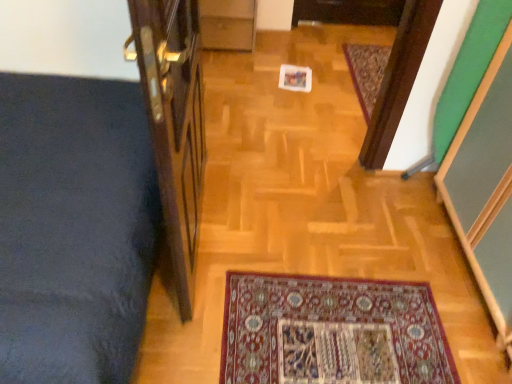
Find the location of `wooden door at left`. wooden door at left is located at coordinates (173, 123).

The width and height of the screenshot is (512, 384). What do you see at coordinates (173, 123) in the screenshot?
I see `wooden door at left` at bounding box center [173, 123].

What is the approximate width of wooden door at left?

wooden door at left is 5.09 inches in width.

Measure the distance between wooden door at left and camera.

The depth of wooden door at left is 75.79 centimeters.

At what (x,y) coordinates should I click in order to perform the action: click on carpeted mat at center. Please return your answer as a coordinate pair (x, y). Image resolution: width=512 pixels, height=384 pixels. Looking at the image, I should click on (367, 72).

What do you see at coordinates (367, 72) in the screenshot?
I see `carpeted mat at center` at bounding box center [367, 72].

Where is `wooden door at left`? The image size is (512, 384). wooden door at left is located at coordinates (173, 123).

Which is more to the left, wooden door at left or carpeted mat at center?

wooden door at left is more to the left.

From the picture: Who is more distant, wooden door at left or carpeted mat at center?

Positioned behind is carpeted mat at center.

Is point (147, 74) positioned behind point (377, 62)?

No.

Based on the photo, from the image's perspective, who appears lower, wooden door at left or carpeted mat at center?

wooden door at left appears lower in the image.

From a real-world perspective, is wooden door at left positioned under carpeted mat at center based on gravity?

No, from a real-world perspective, wooden door at left is not under carpeted mat at center.

Is wooden door at left wider or thinner than carpeted mat at center?

wooden door at left is thinner than carpeted mat at center.

Who is shorter, wooden door at left or carpeted mat at center?

With less height is carpeted mat at center.

From the picture: Does wooden door at left have a smaller size compared to carpeted mat at center?

No, wooden door at left is not smaller than carpeted mat at center.

Is wooden door at left not inside carpeted mat at center?

Yes, wooden door at left is outside of carpeted mat at center.

Are wooden door at left and carpeted mat at center beside each other?

They are not placed beside each other.

Is wooden door at left turned away from carpeted mat at center?

wooden door at left does not have its back to carpeted mat at center.

Identify the location of mat located on the right of wooden door at left. pos(367,72).

Which is more to the right, carpeted mat at center or wooden door at left?

From the viewer's perspective, carpeted mat at center appears more on the right side.

Which is behind, carpeted mat at center or wooden door at left?

carpeted mat at center is further away from the camera.

Does point (371, 104) appear closer or farther from the camera than point (175, 148)?

Point (371, 104) is farther from the camera than point (175, 148).

From the image's perspective, is carpeted mat at center located above wooden door at left?

Yes, from the image's perspective, carpeted mat at center is over wooden door at left.

From a real-world perspective, is carpeted mat at center physically above wooden door at left?

No.

Looking at this image, considering the sizes of objects carpeted mat at center and wooden door at left in the image provided, who is wider, carpeted mat at center or wooden door at left?

With larger width is carpeted mat at center.

Can you confirm if carpeted mat at center is shorter than wooden door at left?

Yes.

Looking at the image, does carpeted mat at center seem bigger or smaller compared to wooden door at left?

Clearly, carpeted mat at center is smaller in size than wooden door at left.

Would you say carpeted mat at center contains wooden door at left?

That's incorrect, wooden door at left is not inside carpeted mat at center.

Is carpeted mat at center directly adjacent to wooden door at left?

No, carpeted mat at center is not touching wooden door at left.

Is carpeted mat at center facing towards wooden door at left?

No, carpeted mat at center is not aimed at wooden door at left.

How different are the orientations of carpeted mat at center and wooden door at left in degrees?

The angular difference between carpeted mat at center and wooden door at left is 177 degrees.

Measure the distance between carpeted mat at center and wooden door at left.

A distance of 1.50 meters exists between carpeted mat at center and wooden door at left.

In the image, there is a wooden door at left. Where is `mat above it (from the image's perspective)`? The width and height of the screenshot is (512, 384). mat above it (from the image's perspective) is located at coordinates (367, 72).

At what (x,y) coordinates should I click in order to perform the action: click on door above the carpeted mat at center (from a real-world perspective). Please return your answer as a coordinate pair (x, y). This screenshot has width=512, height=384. Looking at the image, I should click on (173, 123).

Identify the location of mat above the wooden door at left (from the image's perspective). (367, 72).